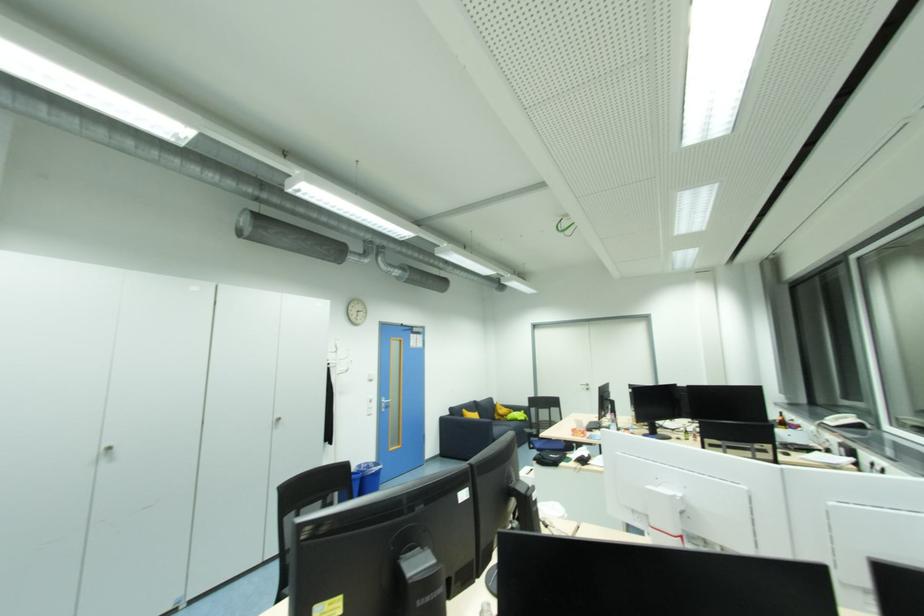
This screenshot has width=924, height=616. What do you see at coordinates (465, 424) in the screenshot? I see `the dark sofa armrest` at bounding box center [465, 424].